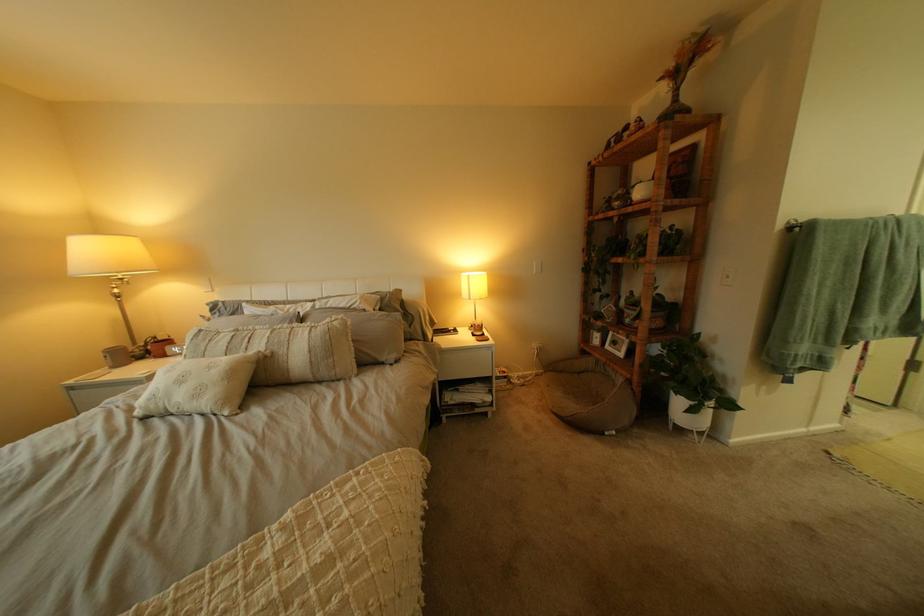
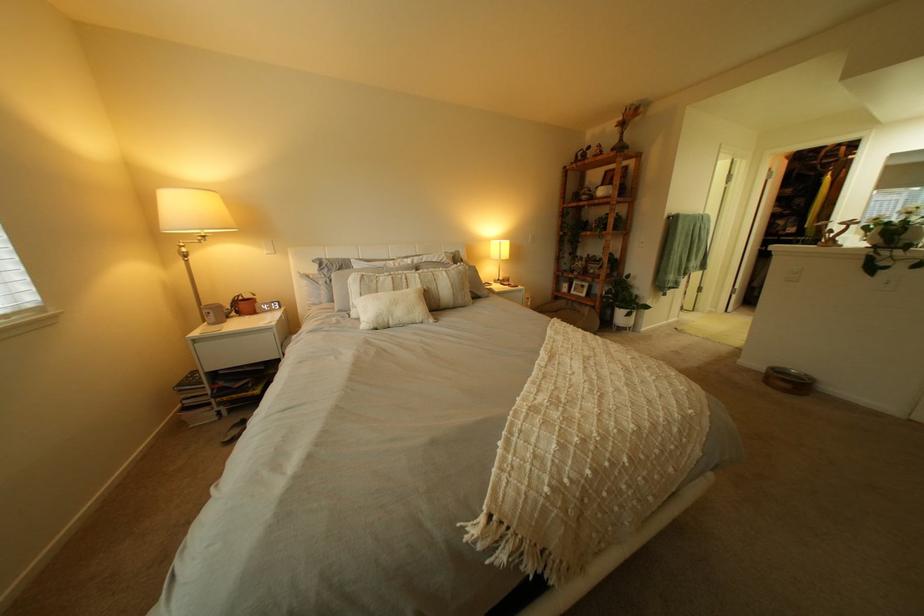
Find the pixel in the second image that matches point (687, 385) in the first image.

(633, 305)